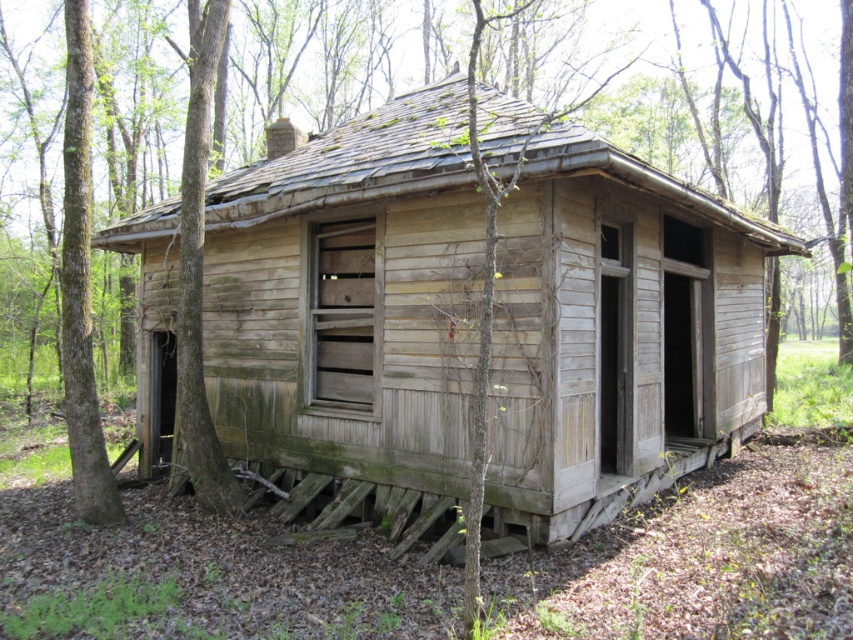
You are an architect assessing the stability of the weathered wood cabin at center and the smooth brown bark at left. Which structure is more likely to withstand heavy winds based on their size?

The smooth brown bark at left is larger than the weathered wood cabin at center, so it is more likely to withstand heavy winds.

In the scene shown: You are standing at the origin point in the image. Where is the weathered wood cabin at center located?

The weathered wood cabin at center is located at point [350,307].